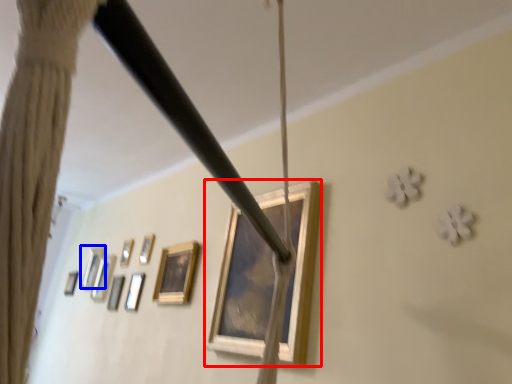
Question: Which object appears closest to the camera in this image, picture frame (highlighted by a red box) or picture frame (highlighted by a blue box)?

Choices:
 (A) picture frame
 (B) picture frame

Answer: (A)